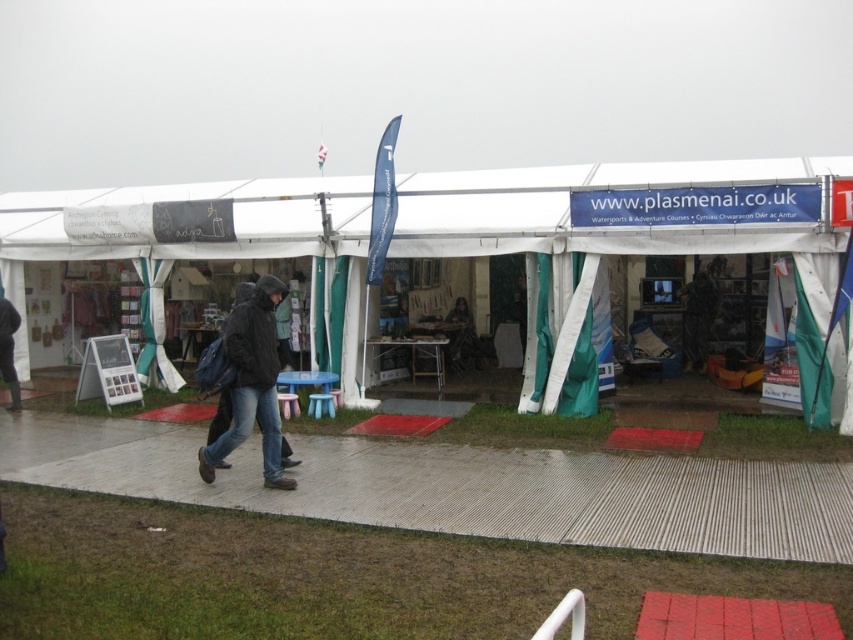
You are standing inside the tent at the event and want to move from the entrance to the banner on the right. There are two points marked in the image, point A at coordinates point (x=685, y=179) and point B at coordinates point (x=4, y=323). Which point is closer to the entrance of the tent?

Point B at coordinates point (x=4, y=323) is closer to the entrance of the tent because it is closer to the viewer, as point A is further away from the camera than point B.

Looking at this image, you are an event organizer who needs to place a 3 meter wide banner between the two black matte jackets. Is there enough space between the black matte jacket at center and the black matte jacket at left to place the banner?

The distance between the black matte jacket at center and the black matte jacket at left is 5.13 meters, which is more than enough to place a 3 meter wide banner between them.

You are organizing a winter event and need to decide which jacket to display first. Both the black matte jacket at center and the dark gray fabric jacket at center are available. Based on their sizes, which one should you choose to place in a prominent spot where space is limited?

The black matte jacket at center is bigger than the dark gray fabric jacket at center, so if space is limited, the dark gray fabric jacket at center would be more suitable for the prominent spot.